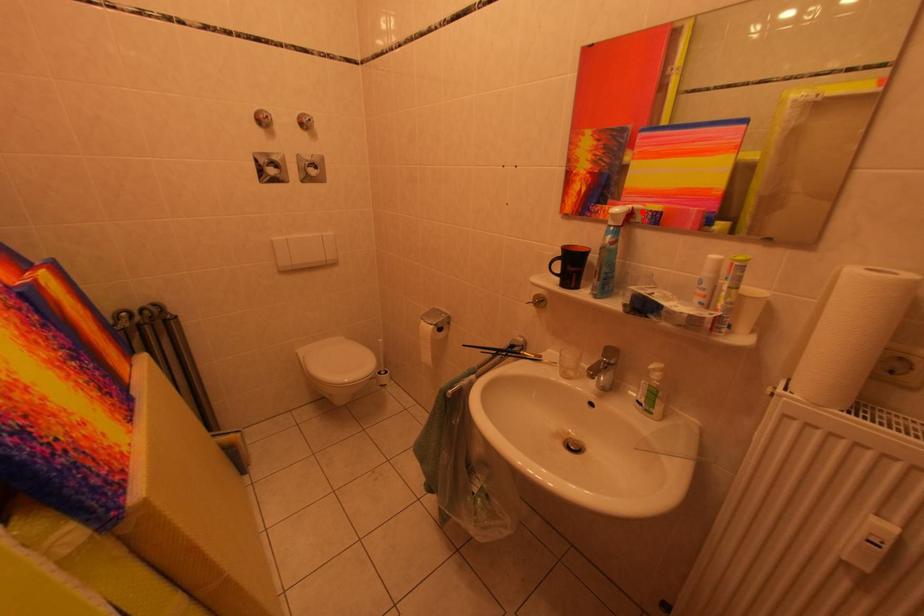
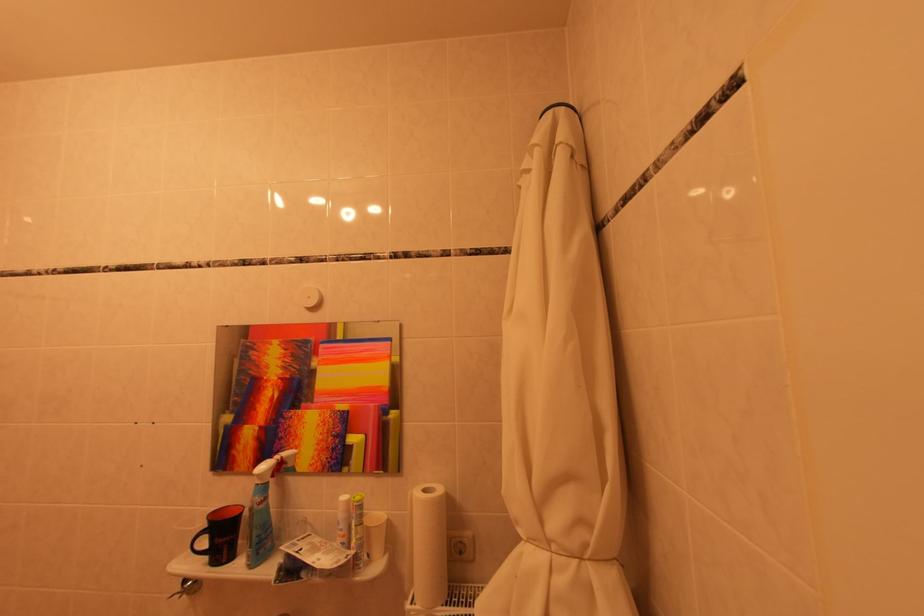
Question: I am providing you with two images of the same scene from different viewpoints. A red point is shown in image1. For the corresponding object point in image2, is it positioned nearer or farther from the camera?

Choices:
 (A) Nearer
 (B) Farther

Answer: (A)